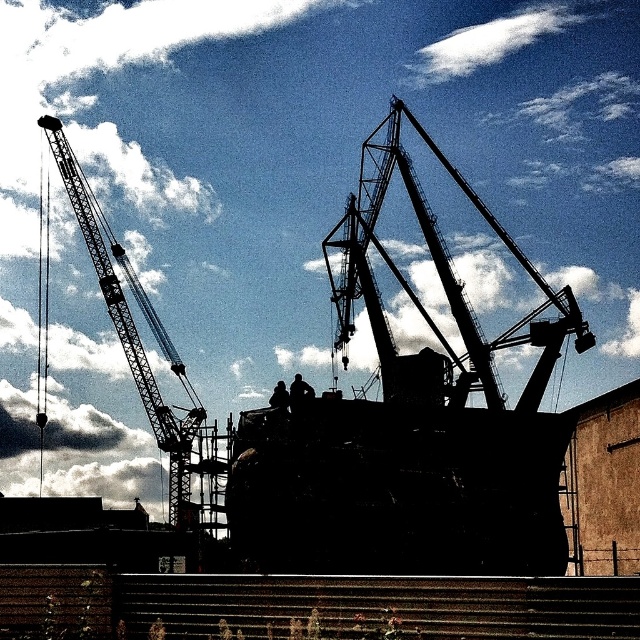
You are a worker on the construction site. You need to know if the black matte boat at center is taller than the silhouette metal crane at center. Can you confirm?

The black matte boat at center has a greater height compared to the silhouette metal crane at center, so yes, it is taller.